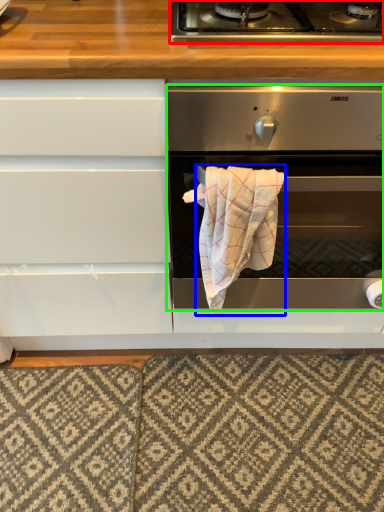
Question: Estimate the real-world distances between objects in this image. Which object is farther from gas stove (highlighted by a red box), bath towel (highlighted by a blue box) or oven (highlighted by a green box)?

Choices:
 (A) bath towel
 (B) oven

Answer: (A)